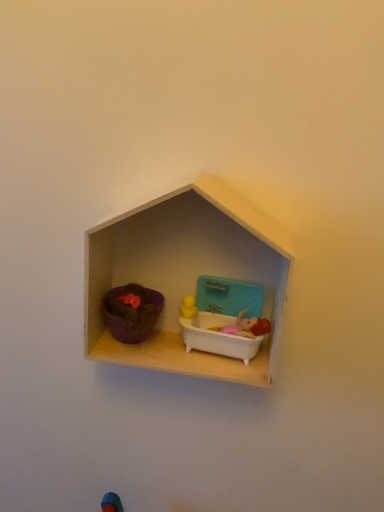
Question: Is white plastic bathtub at center, the 1th toy viewed from the right, bigger or smaller than wooden dollhouse at center?

Choices:
 (A) small
 (B) big

Answer: (A)

Question: Would you say white plastic bathtub at center, which is the second toy from left to right, is inside or outside wooden dollhouse at center?

Choices:
 (A) inside
 (B) outside

Answer: (A)

Question: Which object is the farthest from the white plastic bathtub at center, the 1th toy viewed from the right?

Choices:
 (A) wooden dollhouse at center
 (B) matte purple pot at left, which appears as the 1th toy when viewed from the left

Answer: (B)

Question: Estimate the real-world distances between objects in this image. Which object is farther from the matte purple pot at left, positioned as the 2th toy in right-to-left order?

Choices:
 (A) wooden dollhouse at center
 (B) white plastic bathtub at center, which is the second toy from left to right

Answer: (A)